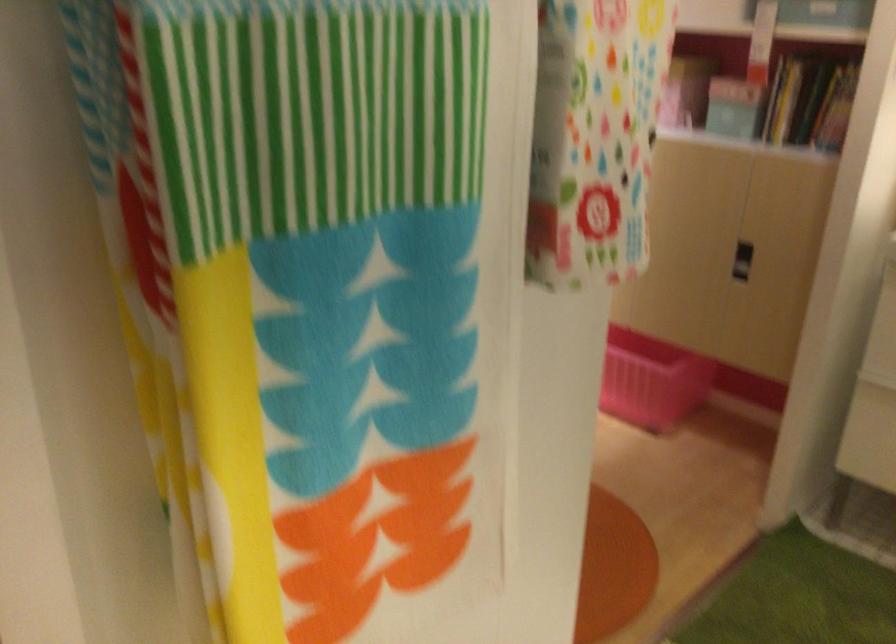
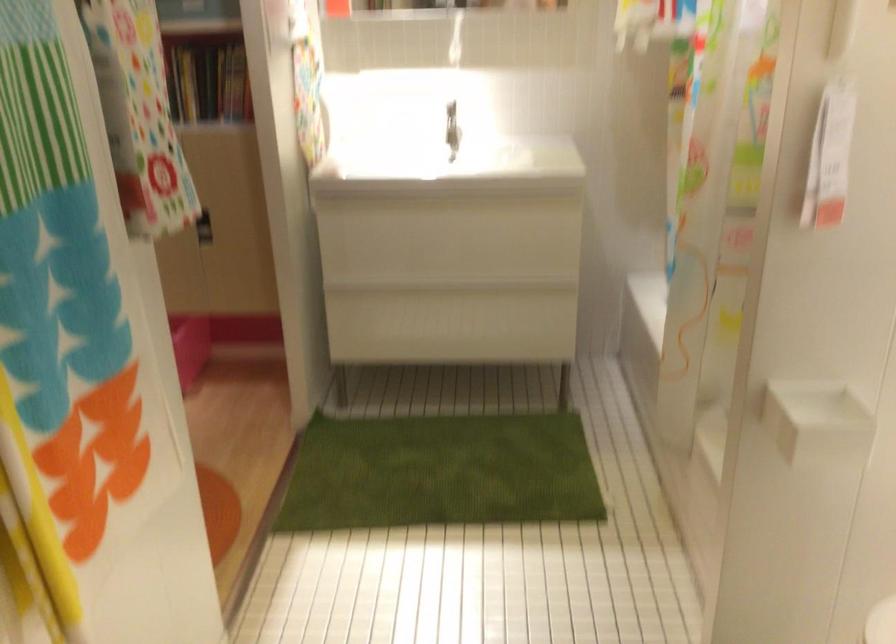
Question: The first image is from the beginning of the video and the second image is from the end. How did the camera likely rotate when shooting the video?

Choices:
 (A) Left
 (B) Right
 (C) Up
 (D) Down

Answer: (B)